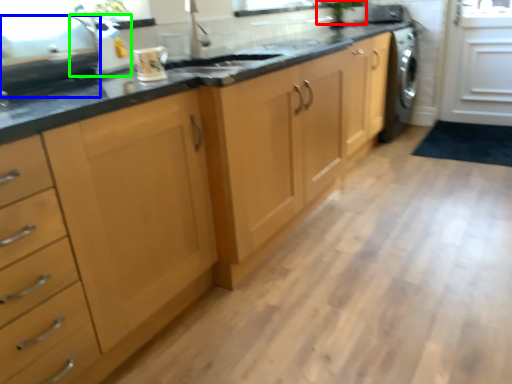
Question: Which object is the farthest from plant (highlighted by a red box)? Choose among these: appliance (highlighted by a blue box) or appliance (highlighted by a green box).

Choices:
 (A) appliance
 (B) appliance

Answer: (A)